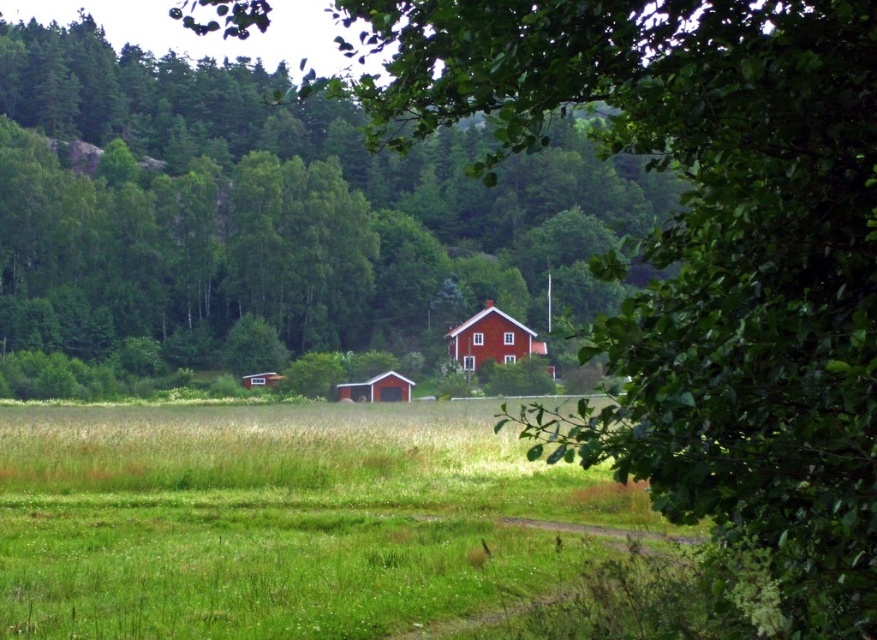
In the scene shown: You are standing at the entrance of the property and want to locate the matte red barn at center. According to the coordinates given, where should you look relative to your position?

A: The matte red barn at center is located at coordinates point (376, 388), which means it is positioned to the right and slightly above your current viewpoint.

You are standing in the middle of the grassy field and looking towards the red house. You see a green leafy tree at center and a wooden barn at center. Which object is higher up in your field of view?

The green leafy tree at center is above the wooden barn at center, so it appears higher up in your field of view.

You are standing in the field and want to walk to the matte red barn at center. There is a green leafy tree at center blocking your path. Can you walk around it to reach the barn?

The green leafy tree at center is closer to you than the matte red barn at center, so you can walk around it to reach the matte red barn at center.